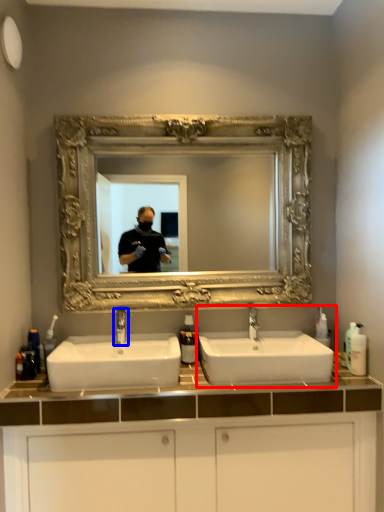
Question: Which point is further to the camera, sink (highlighted by a red box) or tap (highlighted by a blue box)?

Choices:
 (A) sink
 (B) tap

Answer: (B)